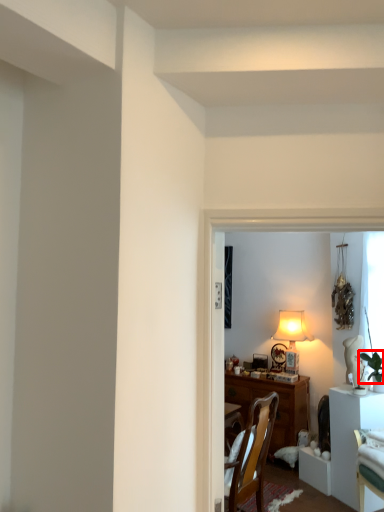
Question: From the image, what is the correct spatial relationship of plant (annotated by the red box) in relation to table?

Choices:
 (A) left
 (B) right

Answer: (B)